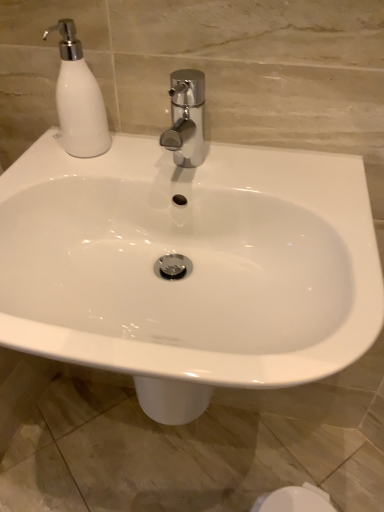
Describe the element at coordinates (189, 262) in the screenshot. I see `white glossy sink at center` at that location.

Locate an element on the screen. white glossy sink at center is located at coordinates (189, 262).

Measure the distance between point [93,139] and camera.

66.70 centimeters.

What is the approximate height of white glossy soap dispenser at upper left?

white glossy soap dispenser at upper left is 7.69 inches in height.

The height and width of the screenshot is (512, 384). I want to click on white glossy soap dispenser at upper left, so click(79, 98).

Describe the element at coordinates (79, 98) in the screenshot. I see `white glossy soap dispenser at upper left` at that location.

This screenshot has height=512, width=384. I want to click on white glossy sink at center, so point(189,262).

Considering the relative positions of white glossy sink at center and white glossy soap dispenser at upper left in the image provided, is white glossy sink at center to the left of white glossy soap dispenser at upper left from the viewer's perspective?

No, white glossy sink at center is not to the left of white glossy soap dispenser at upper left.

Is white glossy sink at center closer to camera compared to white glossy soap dispenser at upper left?

Yes, white glossy sink at center is in front of white glossy soap dispenser at upper left.

Which is nearer, (x=337, y=264) or (x=69, y=47)?

Point (x=337, y=264) appears to be closer to the viewer than point (x=69, y=47).

From the image's perspective, is white glossy sink at center located above or below white glossy soap dispenser at upper left?

Based on their image positions, white glossy sink at center is located beneath white glossy soap dispenser at upper left.

From a real-world perspective, is white glossy sink at center positioned under white glossy soap dispenser at upper left based on gravity?

Yes, from a real-world perspective, white glossy sink at center is below white glossy soap dispenser at upper left.

Does white glossy sink at center have a greater width compared to white glossy soap dispenser at upper left?

Indeed, white glossy sink at center has a greater width compared to white glossy soap dispenser at upper left.

Between white glossy sink at center and white glossy soap dispenser at upper left, which one has more height?

white glossy sink at center is taller.

Considering the sizes of white glossy sink at center and white glossy soap dispenser at upper left in the image, is white glossy sink at center bigger or smaller than white glossy soap dispenser at upper left?

Considering their sizes, white glossy sink at center takes up more space than white glossy soap dispenser at upper left.

Is white glossy sink at center spatially inside white glossy soap dispenser at upper left, or outside of it?

white glossy sink at center is located beyond the bounds of white glossy soap dispenser at upper left.

Is white glossy sink at center next to white glossy soap dispenser at upper left and touching it?

There is a gap between white glossy sink at center and white glossy soap dispenser at upper left.

Is white glossy sink at center positioned with its back to white glossy soap dispenser at upper left?

No.

How many degrees apart are the facing directions of white glossy sink at center and white glossy soap dispenser at upper left?

They differ by 0.0011 degrees in their facing directions.

How distant is white glossy sink at center from white glossy soap dispenser at upper left?

white glossy sink at center and white glossy soap dispenser at upper left are 9.74 inches apart.

Locate an element on the screen. soap dispenser on the left side of white glossy sink at center is located at coordinates (79, 98).

Is white glossy soap dispenser at upper left to the left of white glossy sink at center from the viewer's perspective?

Correct, you'll find white glossy soap dispenser at upper left to the left of white glossy sink at center.

Is the depth of white glossy soap dispenser at upper left greater than that of white glossy sink at center?

Yes, it is behind white glossy sink at center.

Does point (82, 113) appear closer or farther from the camera than point (61, 336)?

Point (82, 113).

From the image's perspective, is white glossy soap dispenser at upper left beneath white glossy sink at center?

No, from the image's perspective, white glossy soap dispenser at upper left is not below white glossy sink at center.

From a real-world perspective, is white glossy soap dispenser at upper left located beneath white glossy sink at center?

Incorrect, from a real-world perspective, white glossy soap dispenser at upper left is higher than white glossy sink at center.

Is white glossy soap dispenser at upper left wider or thinner than white glossy sink at center?

Clearly, white glossy soap dispenser at upper left has less width compared to white glossy sink at center.

Consider the image. Is white glossy soap dispenser at upper left taller than white glossy sink at center?

No.

Can you confirm if white glossy soap dispenser at upper left is bigger than white glossy sink at center?

No.

Does white glossy soap dispenser at upper left contain white glossy sink at center?

No, white glossy sink at center is not inside white glossy soap dispenser at upper left.

Consider the image. Are white glossy soap dispenser at upper left and white glossy sink at center far apart?

That's not correct — white glossy soap dispenser at upper left is a little close to white glossy sink at center.

Could you tell me if white glossy soap dispenser at upper left is facing white glossy sink at center?

No, white glossy soap dispenser at upper left is not facing towards white glossy sink at center.

How much distance is there between white glossy soap dispenser at upper left and white glossy sink at center?

The distance of white glossy soap dispenser at upper left from white glossy sink at center is 9.74 inches.

Find the location of `soap dispenser above the white glossy sink at center (from a real-world perspective)`. soap dispenser above the white glossy sink at center (from a real-world perspective) is located at coordinates (79, 98).

Find the location of a particular element. The height and width of the screenshot is (512, 384). sink below the white glossy soap dispenser at upper left (from the image's perspective) is located at coordinates (189, 262).

Locate an element on the screen. soap dispenser positioned vertically above the white glossy sink at center (from a real-world perspective) is located at coordinates (79, 98).